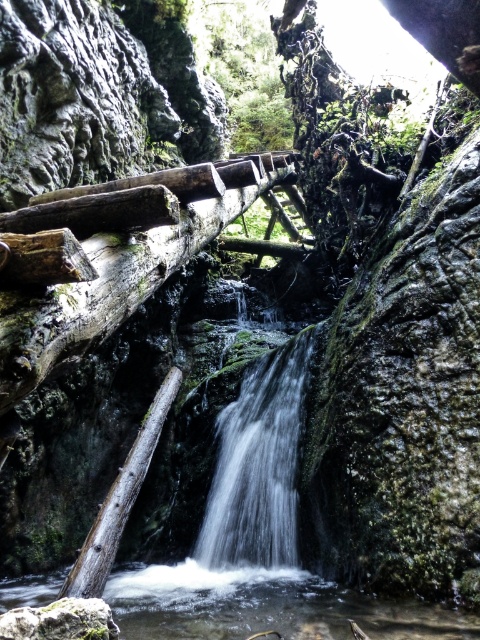
You are a hiker standing on the wooden bridge at the top of the frame. You want to take a photo of the clear water at center and the green leafy tree at upper center. Which object should you point your camera towards first if you want to capture both in one shot?

The clear water at center is to the left of the green leafy tree at upper center, so you should point your camera towards the clear water at center first to include both in the shot.

You are standing at the edge of the cliff and see the point at coordinates (x=115, y=282). What object is located at that point?

The point at coordinates (x=115, y=282) corresponds to the weathered wood bridge at center.

You are standing at the wooden bridge made from logs at the top of the frame and want to walk towards the waterfall. Which point, point (267, 596) or point (228, 68), would you encounter first?

Point (267, 596) is in front of point (228, 68), so you would encounter point (267, 596) first when walking towards the waterfall.